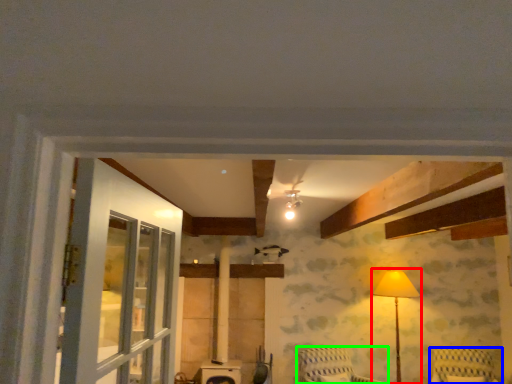
Question: Considering the real-world distances, which object is farthest from table lamp (highlighted by a red box)? furniture (highlighted by a blue box) or furniture (highlighted by a green box)?

Choices:
 (A) furniture
 (B) furniture

Answer: (B)